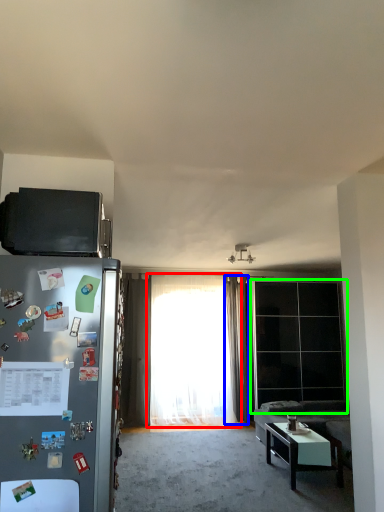
Question: Estimate the real-world distances between objects in this image. Which object is farther from curtain (highlighted by a red box), curtain (highlighted by a blue box) or glass door (highlighted by a green box)?

Choices:
 (A) curtain
 (B) glass door

Answer: (B)